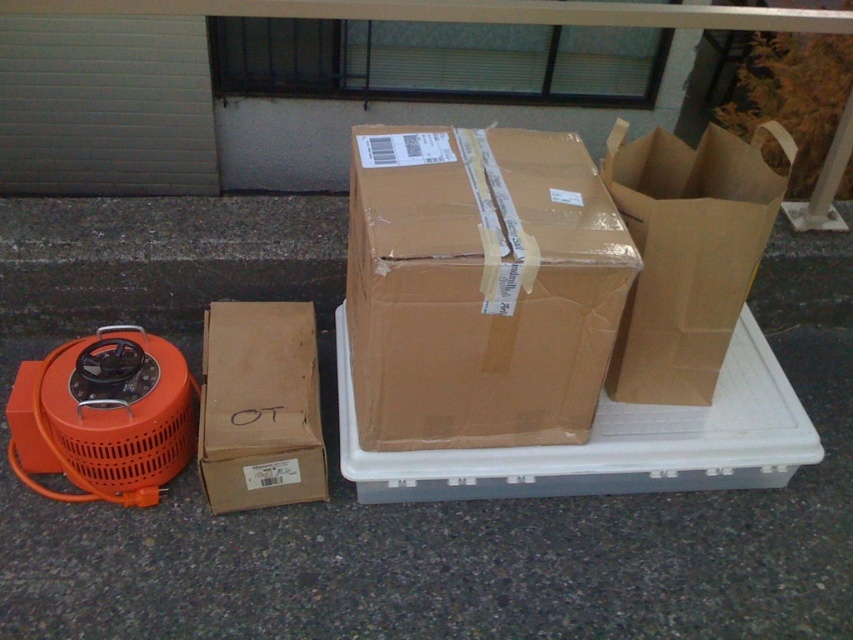
You are a delivery person who just arrived at the location. You see the brown cardboard box at center and the brown cardboard box at lower left. Which one is positioned higher from the ground?

The brown cardboard box at center is positioned higher from the ground than the brown cardboard box at lower left because it is above it.

You are moving boxes and need to decide which container can hold more items. Based on the image, which one is bigger between the brown cardboard box at center and the brown paper bag at upper right?

The brown cardboard box at center is larger in size than the brown paper bag at upper right, so it can hold more items.

Consider the image. You are organizing items on a concrete surface and need to place a new item between the brown cardboard box at center and the brown paper bag at upper right. Based on their positions, which object should you place the new item closer to?

The brown cardboard box at center is positioned on the left side of brown paper bag at upper right, so the new item should be placed closer to the brown cardboard box at center to maintain the order.